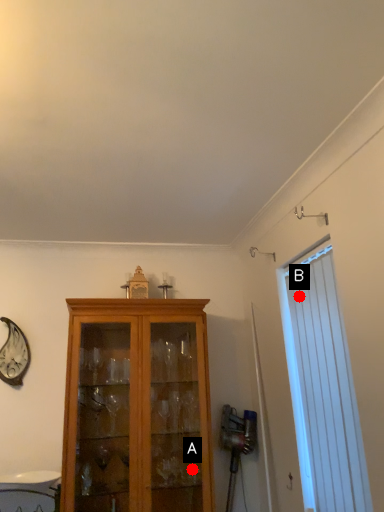
Question: Two points are circled on the image, labeled by A and B beside each circle. Which point appears closest to the camera in this image?

Choices:
 (A) A is closer
 (B) B is closer

Answer: (B)